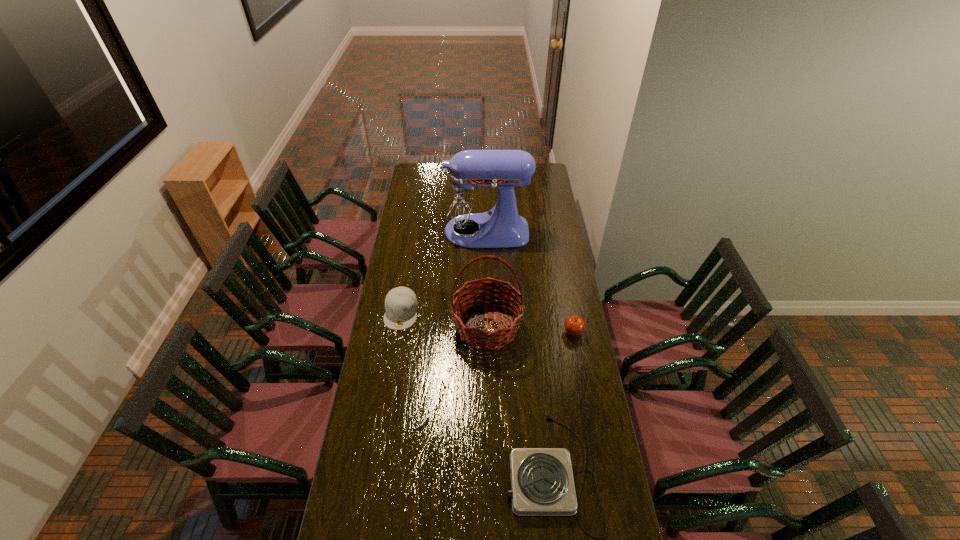
Where is `free spot between the hotplate and the mixer`? free spot between the hotplate and the mixer is located at coordinates pos(517,351).

Locate an element on the screen. The width and height of the screenshot is (960, 540). free space between the nearest object and the apple is located at coordinates (563, 402).

I want to click on free space between the nearest object and the leftmost object, so click(x=476, y=391).

I want to click on empty space that is in between the basket and the apple, so click(530, 329).

What are the coordinates of `blank region between the leftmost object and the basket` in the screenshot? It's located at (444, 319).

In order to click on vacant space that's between the apple and the farthest object in this screenshot , I will do `click(528, 282)`.

This screenshot has width=960, height=540. Find the location of `vacant space that is in between the basket and the apple`. vacant space that is in between the basket and the apple is located at coordinates (530, 329).

This screenshot has width=960, height=540. I want to click on free spot between the hotplate and the basket, so click(x=519, y=399).

In order to click on empty location between the farthest object and the shortest object in this screenshot , I will do pos(517,351).

Identify the location of object that is the closest one to the mixer. The height and width of the screenshot is (540, 960). (401, 304).